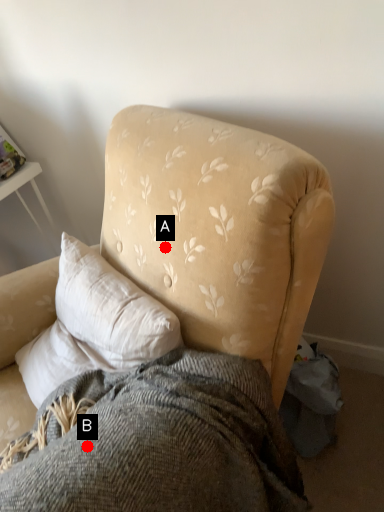
Question: Two points are circled on the image, labeled by A and B beside each circle. Which of the following is the farthest from the observer?

Choices:
 (A) A is further
 (B) B is further

Answer: (A)